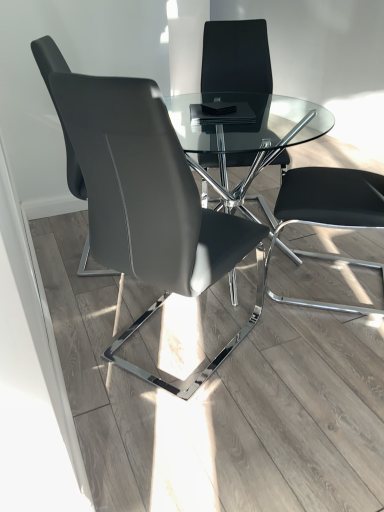
What do you see at coordinates (329, 199) in the screenshot?
I see `black leather chair at right` at bounding box center [329, 199].

Measure the distance between black leather chair at center, which is counted as the first chair, starting from the back, and camera.

They are 2.23 meters apart.

Where is `black leather chair at right`? black leather chair at right is located at coordinates (329, 199).

In the scene shown: Which of these two, matte black chair at left, which is the second chair in back-to-front order, or black leather chair at right, stands shorter?

With less height is black leather chair at right.

Image resolution: width=384 pixels, height=512 pixels. What are the coordinates of `chair that appears above the black leather chair at right (from a real-world perspective)` in the screenshot? It's located at (56, 106).

From the image's perspective, is matte black chair at left, which is the second chair in back-to-front order, positioned above or below black leather chair at right?

From the image's perspective, matte black chair at left, which is the second chair in back-to-front order, appears above black leather chair at right.

From the image's perspective, relative to matte black chair at left, the 2th chair viewed from the front, is black leather chair at right above or below?

black leather chair at right is below matte black chair at left, the 2th chair viewed from the front.

Locate an element on the screen. The image size is (384, 512). computer chair beneath the matte black chair at left, the 2th chair viewed from the front (from a real-world perspective) is located at coordinates (329, 199).

Looking at this image, can you tell me how much black leather chair at right and matte black chair at left, which is the second chair in back-to-front order, differ in facing direction?

There is a 159-degree angle between the facing directions of black leather chair at right and matte black chair at left, which is the second chair in back-to-front order.

Which point is more distant from viewer, (351,169) or (69,70)?

The point (351,169) is farther from the camera.

From a real-world perspective, which object rests below the other?

From a 3D spatial view, black leather chair at center, which is counted as the first chair, starting from the back, is below.

Is matte black chair at center, positioned as the third chair in back-to-front order, positioned with its back to black leather chair at center, which is counted as the first chair, starting from the back?

No, matte black chair at center, positioned as the third chair in back-to-front order, is not facing away from black leather chair at center, which is counted as the first chair, starting from the back.

Based on the photo, which is behind, matte black chair at center, placed as the first chair when sorted from front to back, or black leather chair at center, which is counted as the third chair, starting from the front?

black leather chair at center, which is counted as the third chair, starting from the front, is behind.

You are a GUI agent. You are given a task and a screenshot of the screen. Output one action in this format:
    pyautogui.click(x=<x>, y=<y>)
    Task: Click on the 2nd chair in front of the black leather chair at center, which is counted as the first chair, starting from the back, counting from the anchor's position
    The image size is (384, 512).
    Given the screenshot: What is the action you would take?
    pyautogui.click(x=144, y=197)

Is black leather chair at center, which is counted as the first chair, starting from the back, wider than black leather chair at right?

Yes, black leather chair at center, which is counted as the first chair, starting from the back, is wider than black leather chair at right.

From a real-world perspective, is black leather chair at center, which is counted as the first chair, starting from the back, positioned above or below black leather chair at right?

In terms of real-world spatial position, black leather chair at center, which is counted as the first chair, starting from the back, is below black leather chair at right.

Which of these two, matte black chair at left, which is the second chair in back-to-front order, or matte black chair at center, positioned as the third chair in back-to-front order, stands shorter?

With less height is matte black chair at left, which is the second chair in back-to-front order.

Could you tell me if matte black chair at left, which is the second chair in back-to-front order, is facing matte black chair at center, positioned as the third chair in back-to-front order?

No, matte black chair at left, which is the second chair in back-to-front order, is not oriented towards matte black chair at center, positioned as the third chair in back-to-front order.

Consider the image. From a real-world perspective, is matte black chair at left, the 2th chair viewed from the front, positioned over matte black chair at center, placed as the first chair when sorted from front to back, based on gravity?

Indeed, from a real-world perspective, matte black chair at left, the 2th chair viewed from the front, stands above matte black chair at center, placed as the first chair when sorted from front to back.

Can you confirm if black leather chair at center, which is counted as the first chair, starting from the back, is taller than matte black chair at left, which is the second chair in back-to-front order?

Yes.

Based on their positions, is black leather chair at center, which is counted as the first chair, starting from the back, located to the left or right of matte black chair at left, the 2th chair viewed from the front?

Based on their positions, black leather chair at center, which is counted as the first chair, starting from the back, is located to the right of matte black chair at left, the 2th chair viewed from the front.

Based on the photo, would you say matte black chair at left, which is the second chair in back-to-front order, is part of black leather chair at center, which is counted as the third chair, starting from the front,'s contents?

No, matte black chair at left, which is the second chair in back-to-front order, is not surrounded by black leather chair at center, which is counted as the third chair, starting from the front.

Which of these two, matte black chair at center, positioned as the third chair in back-to-front order, or black leather chair at right, is bigger?

With larger size is matte black chair at center, positioned as the third chair in back-to-front order.

Is matte black chair at center, placed as the first chair when sorted from front to back, to the left or to the right of black leather chair at right in the image?

matte black chair at center, placed as the first chair when sorted from front to back, is positioned on black leather chair at right's left side.

What's the angular difference between matte black chair at center, placed as the first chair when sorted from front to back, and black leather chair at right's facing directions?

106 degrees separate the facing orientations of matte black chair at center, placed as the first chair when sorted from front to back, and black leather chair at right.

From the image's perspective, which object appears higher, matte black chair at center, placed as the first chair when sorted from front to back, or black leather chair at right?

black leather chair at right, from the image's perspective.

Locate an element on the screen. The image size is (384, 512). chair that is the 1st object located above the black leather chair at right (from the image's perspective) is located at coordinates (56, 106).

Identify the location of computer chair lying below the matte black chair at left, which is the second chair in back-to-front order (from the image's perspective). (329, 199).

Looking at this image, from the image, which object appears to be farther from black leather chair at center, which is counted as the third chair, starting from the front, matte black chair at center, placed as the first chair when sorted from front to back, or black leather chair at right?

matte black chair at center, placed as the first chair when sorted from front to back.

Which object lies further to the anchor point matte black chair at center, positioned as the third chair in back-to-front order, black leather chair at center, which is counted as the third chair, starting from the front, or black leather chair at right?

black leather chair at center, which is counted as the third chair, starting from the front, is positioned further to the anchor matte black chair at center, positioned as the third chair in back-to-front order.

Looking at the image, which one is located further to matte black chair at left, the 2th chair viewed from the front, matte black chair at center, placed as the first chair when sorted from front to back, or black leather chair at center, which is counted as the first chair, starting from the back?

black leather chair at center, which is counted as the first chair, starting from the back, is further to matte black chair at left, the 2th chair viewed from the front.

From the image, which object appears to be nearer to black leather chair at center, which is counted as the first chair, starting from the back, matte black chair at left, which is the second chair in back-to-front order, or black leather chair at right?

black leather chair at right is positioned closer to the anchor black leather chair at center, which is counted as the first chair, starting from the back.

Estimate the real-world distances between objects in this image. Which object is further from matte black chair at left, which is the second chair in back-to-front order, black leather chair at right or matte black chair at center, placed as the first chair when sorted from front to back?

black leather chair at right lies further to matte black chair at left, which is the second chair in back-to-front order, than the other object.

Looking at the image, which one is located closer to matte black chair at center, placed as the first chair when sorted from front to back, matte black chair at left, which is the second chair in back-to-front order, or black leather chair at right?

matte black chair at left, which is the second chair in back-to-front order, is positioned closer to the anchor matte black chair at center, placed as the first chair when sorted from front to back.

Based on their spatial positions, is black leather chair at right or matte black chair at center, positioned as the third chair in back-to-front order, closer to black leather chair at center, which is counted as the first chair, starting from the back?

Among the two, black leather chair at right is located nearer to black leather chair at center, which is counted as the first chair, starting from the back.

Estimate the real-world distances between objects in this image. Which object is closer to black leather chair at right, black leather chair at center, which is counted as the first chair, starting from the back, or matte black chair at center, placed as the first chair when sorted from front to back?

Among the two, matte black chair at center, placed as the first chair when sorted from front to back, is located nearer to black leather chair at right.

The width and height of the screenshot is (384, 512). What are the coordinates of `chair between matte black chair at center, placed as the first chair when sorted from front to back, and black leather chair at center, which is counted as the third chair, starting from the front, along the z-axis` in the screenshot? It's located at (56, 106).

Where is `computer chair between matte black chair at center, placed as the first chair when sorted from front to back, and black leather chair at center, which is counted as the first chair, starting from the back, along the z-axis`? The width and height of the screenshot is (384, 512). computer chair between matte black chair at center, placed as the first chair when sorted from front to back, and black leather chair at center, which is counted as the first chair, starting from the back, along the z-axis is located at coordinates click(x=329, y=199).